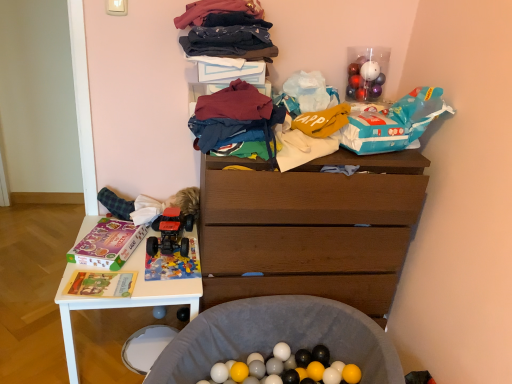
The height and width of the screenshot is (384, 512). Find the location of `free point to the right of matte yellow book at lower left, arranged as the first magazine when ordered from the bottom`. free point to the right of matte yellow book at lower left, arranged as the first magazine when ordered from the bottom is located at coordinates (156, 287).